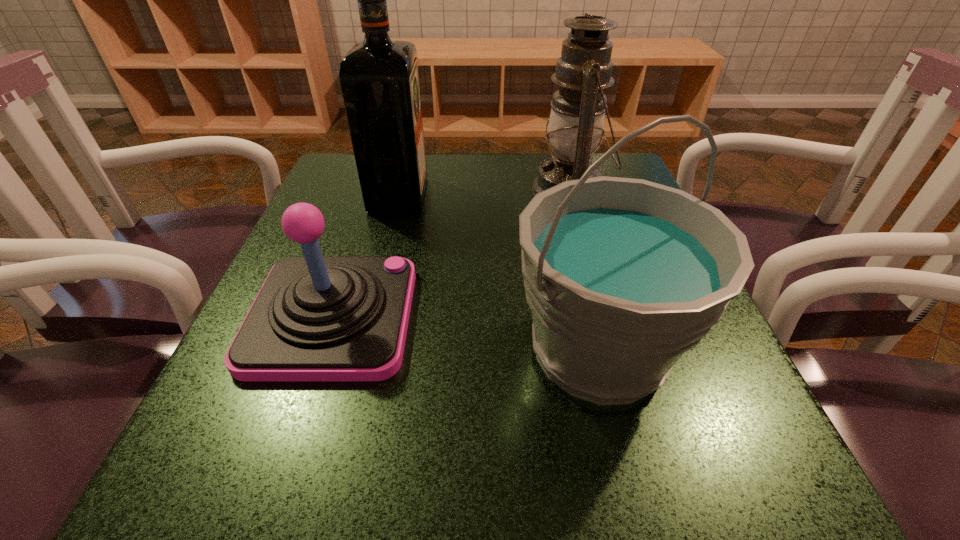
I want to click on the second closest object relative to the liquor, so click(x=576, y=122).

Identify which object is located as the third nearest to the bucket. Please provide its 2D coordinates. Your answer should be formatted as a tuple, i.e. [(x, y)], where the tuple contains the x and y coordinates of a point satisfying the conditions above.

[(379, 77)]

Locate an element on the screen. This screenshot has width=960, height=540. vacant region that satisfies the following two spatial constraints: 1. on the front label of the bucket; 2. on the left side of the liquor is located at coordinates (358, 350).

The image size is (960, 540). I want to click on vacant space that satisfies the following two spatial constraints: 1. on the front label of the liquor; 2. on the back side of the bucket, so click(x=358, y=350).

Locate an element on the screen. free space that satisfies the following two spatial constraints: 1. on the front side of the oil lamp; 2. on the front label of the liquor is located at coordinates (571, 195).

The width and height of the screenshot is (960, 540). Find the location of `free space in the image that satisfies the following two spatial constraints: 1. forward from the base of the bucket; 2. on the right side of the joystick`. free space in the image that satisfies the following two spatial constraints: 1. forward from the base of the bucket; 2. on the right side of the joystick is located at coordinates (322, 350).

Identify the location of free space that satisfies the following two spatial constraints: 1. forward from the base of the shortest object; 2. on the back side of the bucket. The image size is (960, 540). (322, 350).

The height and width of the screenshot is (540, 960). I want to click on vacant region that satisfies the following two spatial constraints: 1. on the back side of the bucket; 2. forward from the base of the shortest object, so click(x=590, y=317).